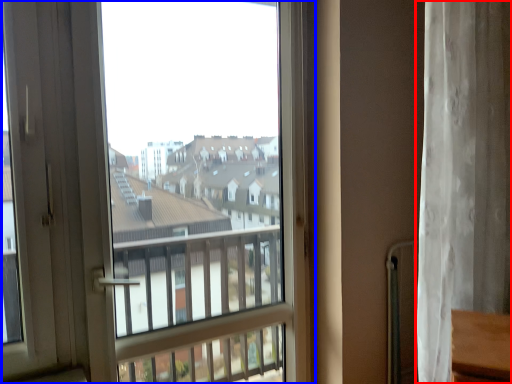
Question: Which object appears farthest to the camera in this image, curtain (highlighted by a red box) or window (highlighted by a blue box)?

Choices:
 (A) curtain
 (B) window

Answer: (A)